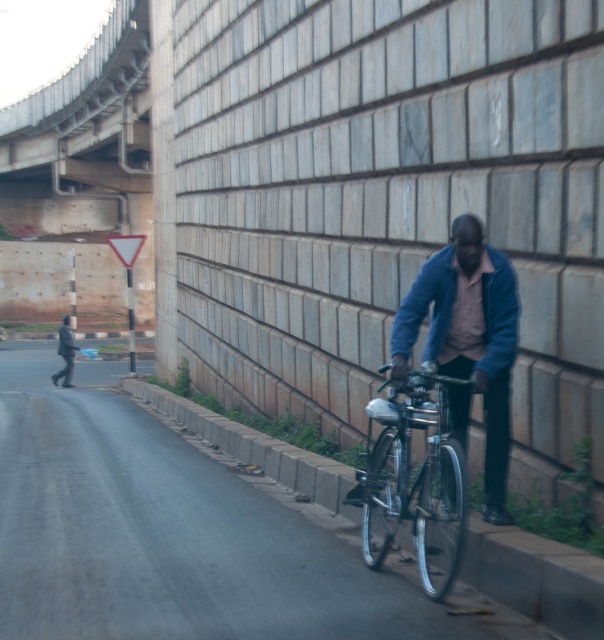
You are a delivery person who needs to deliver a package to the address on the bicycle. The package is too large to fit in the basket. Can you attach it to the silver metallic bicycle at right without covering the blue fabric jacket at center?

The blue fabric jacket at center is positioned over the silver metallic bicycle at right, which means the jacket is covering part of the bicycle. This would make it difficult to securely attach the package to the bicycle without covering the jacket further.